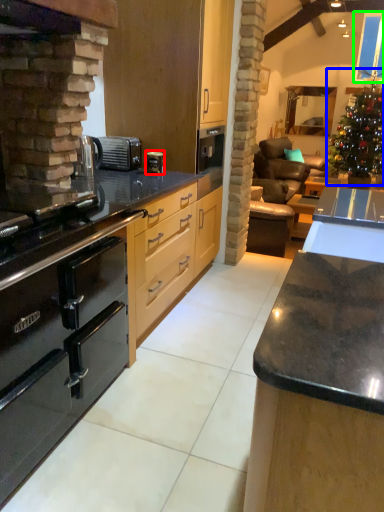
Question: Based on their relative distances, which object is farther from coffee machine (highlighted by a red box)? Choose from christmas tree (highlighted by a blue box) and window screen (highlighted by a green box).

Choices:
 (A) christmas tree
 (B) window screen

Answer: (B)